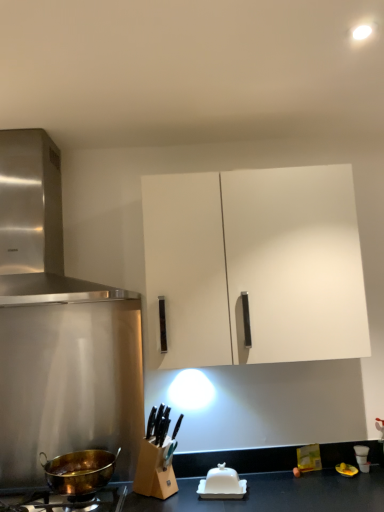
Question: Does stainless steel range hood at upper left appear on the left side of gold metallic pot at lower left?

Choices:
 (A) yes
 (B) no

Answer: (A)

Question: Is the position of stainless steel range hood at upper left more distant than that of gold metallic pot at lower left?

Choices:
 (A) yes
 (B) no

Answer: (A)

Question: Is stainless steel range hood at upper left not within gold metallic pot at lower left?

Choices:
 (A) no
 (B) yes

Answer: (B)

Question: From a real-world perspective, is stainless steel range hood at upper left over gold metallic pot at lower left?

Choices:
 (A) yes
 (B) no

Answer: (A)

Question: Does stainless steel range hood at upper left touch gold metallic pot at lower left?

Choices:
 (A) yes
 (B) no

Answer: (B)

Question: Based on their positions, is gold metallic pot at lower left located to the left or right of gold-bronze wok at lower left?

Choices:
 (A) left
 (B) right

Answer: (A)

Question: From a real-world perspective, is gold metallic pot at lower left positioned above or below gold-bronze wok at lower left?

Choices:
 (A) below
 (B) above

Answer: (A)

Question: Considering the positions of point (99, 502) and point (64, 467), is point (99, 502) closer or farther from the camera than point (64, 467)?

Choices:
 (A) closer
 (B) farther

Answer: (B)

Question: Looking at the image, does gold metallic pot at lower left seem bigger or smaller compared to gold-bronze wok at lower left?

Choices:
 (A) big
 (B) small

Answer: (A)

Question: Do you think gold-bronze wok at lower left is within stainless steel range hood at upper left, or outside of it?

Choices:
 (A) outside
 (B) inside

Answer: (A)

Question: Considering the positions of gold-bronze wok at lower left and stainless steel range hood at upper left in the image, is gold-bronze wok at lower left taller or shorter than stainless steel range hood at upper left?

Choices:
 (A) tall
 (B) short

Answer: (B)

Question: From a real-world perspective, is gold-bronze wok at lower left above or below stainless steel range hood at upper left?

Choices:
 (A) above
 (B) below

Answer: (B)

Question: Is point (51, 478) positioned closer to the camera than point (29, 238)?

Choices:
 (A) farther
 (B) closer

Answer: (B)

Question: From their relative heights in the image, would you say white matte cabinet at upper center is taller or shorter than stainless steel range hood at upper left?

Choices:
 (A) tall
 (B) short

Answer: (A)

Question: Is white matte cabinet at upper center situated inside stainless steel range hood at upper left or outside?

Choices:
 (A) outside
 (B) inside

Answer: (A)